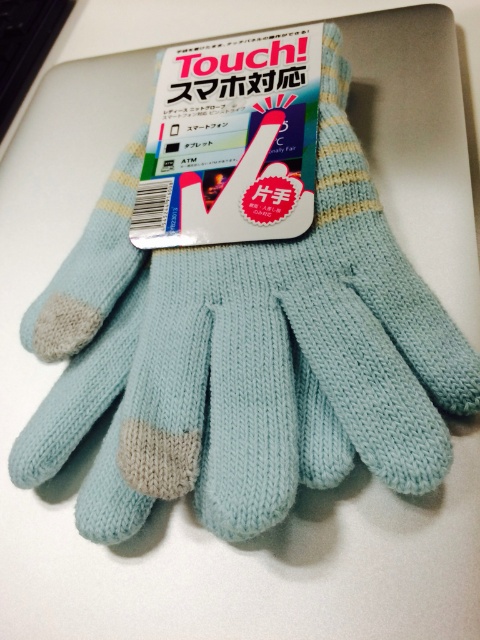
You are organizing a desk and need to place the matte blue knitted gloves at center and the black plastic keyboard at upper left. Which object should you place first if you want to ensure the taller item is positioned where it won

The matte blue knitted gloves at center should be placed first because they are taller than the black plastic keyboard at upper left. This way, you can ensure the taller item is positioned where it won

You are organizing a desk and need to place the matte blue knitted gloves at center and the black plastic keyboard at upper left. Based on their positions, which object is nearer to you?

The matte blue knitted gloves at center are closer to the viewer than the black plastic keyboard at upper left.